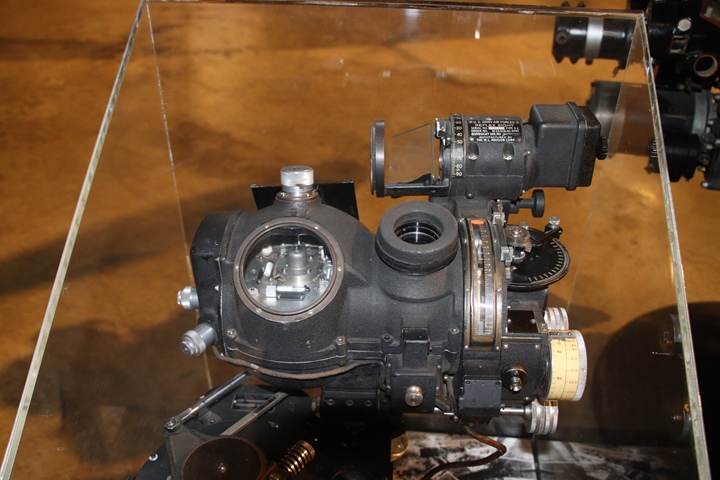
The height and width of the screenshot is (480, 720). Identify the location of floor. (60, 105).